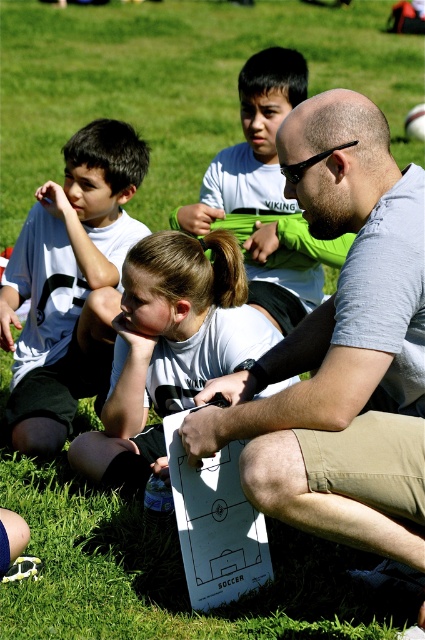
You are a photographer trying to capture a photo of the white matte paper at center. To avoid having the white matte shirt at upper left in the background, should you move to the left or right of the paper?

Move to the right of the white matte paper at center to avoid the white matte shirt at upper left appearing in the background since the shirt is to the left of the paper.

Consider the image. You are a photographer standing at the center of the field. You want to take a photo that includes both the white matte shirt at upper left and the white matte paper at center. What is the minimum distance you need to move forward to ensure both objects are in frame?

The white matte shirt at upper left is 20.65 inches away from the white matte paper at center. To include both in the frame, you need to move forward by at least half of the distance between them, which is approximately 10.325 inches.